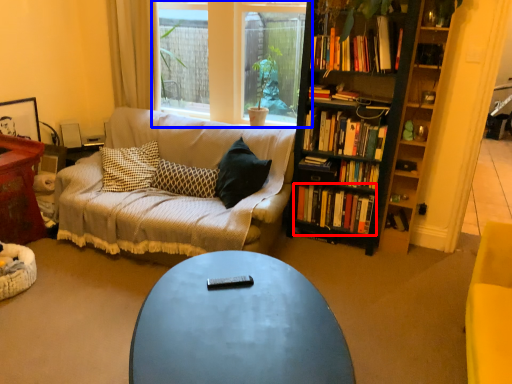
Question: Which object is further to the camera taking this photo, book (highlighted by a red box) or window (highlighted by a blue box)?

Choices:
 (A) book
 (B) window

Answer: (A)